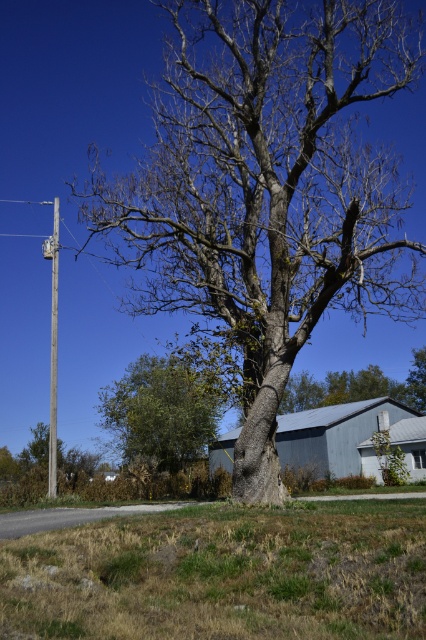
You are standing in the rural area shown in the image. You want to walk from the smooth gray bark oak tree at center to the green leafy bush at lower left. Which direction should you move relative to the tree?

You should move towards the lower left direction relative to the smooth gray bark oak tree at center to reach the green leafy bush at lower left.

You are standing at the center of the image and want to move towards the green leafy bush at lower left. Which direction should you face to walk directly towards it?

The green leafy bush at lower left is located at point (x=161, y=412), which means it is positioned to the lower left from your current position at the center. To walk directly towards it, you should face the lower left direction.

You are a gardener planning to plant a new tree between the green leafy bush at lower left and the wooden pole at left. Which object should you use as a reference for the minimum required height of the new tree?

The green leafy bush at lower left has a lesser height compared to wooden pole at left, so the wooden pole at left is taller. Therefore, the minimum required height for the new tree should be at least as tall as the wooden pole at left to ensure it surpasses both objects.